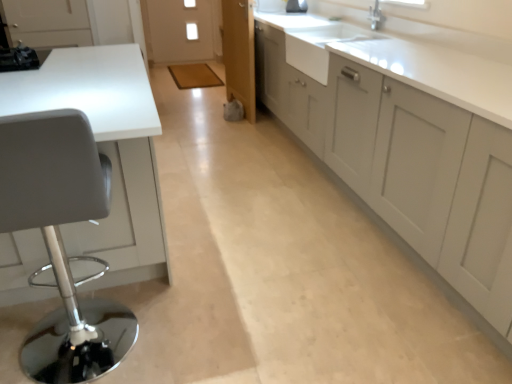
What is the approximate height of white glossy countertop at left?

The height of white glossy countertop at left is 35.45 inches.

The image size is (512, 384). Find the location of `white glossy countertop at left`. white glossy countertop at left is located at coordinates (106, 151).

At what (x,y) coordinates should I click in order to perform the action: click on white ceramic sink at upper right. Please return your answer as a coordinate pair (x, y). The height and width of the screenshot is (384, 512). Looking at the image, I should click on (320, 46).

What's the angular difference between white ceramic sink at upper right and white glossy countertop at left's facing directions?

89.1 degrees.

Where is `countertop below the white ceramic sink at upper right (from a real-world perspective)`? countertop below the white ceramic sink at upper right (from a real-world perspective) is located at coordinates (106, 151).

Choose the correct answer: Is white ceramic sink at upper right inside white glossy countertop at left or outside it?

white ceramic sink at upper right is not inside white glossy countertop at left, it's outside.

From a real-world perspective, which is physically below, white ceramic sink at upper right or white glossy countertop at left?

white glossy countertop at left is physically lower.

What's the angular difference between matte gray cabinets at right and white glossy countertop at left's facing directions?

90.4 degrees.

Does matte gray cabinets at right contain white glossy countertop at left?

No, white glossy countertop at left is not inside matte gray cabinets at right.

Is matte gray cabinets at right bigger than white glossy countertop at left?

Yes, matte gray cabinets at right is bigger than white glossy countertop at left.

Does matte gray cabinets at right have a greater width compared to white glossy countertop at left?

No.

Considering the sizes of white glossy countertop at left and matte gray cabinets at right in the image, is white glossy countertop at left taller or shorter than matte gray cabinets at right?

white glossy countertop at left is shorter than matte gray cabinets at right.

Is white glossy countertop at left facing away from matte gray cabinets at right?

No, white glossy countertop at left is not facing away from matte gray cabinets at right.

From the image's perspective, which one is positioned lower, white glossy countertop at left or matte gray cabinets at right?

white glossy countertop at left is shown below in the image.

From a real-world perspective, who is located lower, white glossy countertop at left or matte gray cabinets at right?

white glossy countertop at left, from a real-world perspective.

Which of these two, white glossy countertop at left or white ceramic sink at upper right, is thinner?

With smaller width is white ceramic sink at upper right.

Considering the sizes of objects white glossy countertop at left and white ceramic sink at upper right in the image provided, who is shorter, white glossy countertop at left or white ceramic sink at upper right?

With less height is white ceramic sink at upper right.

Can you confirm if white glossy countertop at left is smaller than white ceramic sink at upper right?

No, white glossy countertop at left is not smaller than white ceramic sink at upper right.

Is white glossy countertop at left not near white ceramic sink at upper right?

Yes.

Find the location of a particular element. cabinetry that appears on the right of white ceramic sink at upper right is located at coordinates (404, 159).

Considering the relative sizes of matte gray cabinets at right and white ceramic sink at upper right in the image provided, is matte gray cabinets at right wider than white ceramic sink at upper right?

Indeed, matte gray cabinets at right has a greater width compared to white ceramic sink at upper right.

Is matte gray cabinets at right not within white ceramic sink at upper right?

Yes, matte gray cabinets at right is located beyond the bounds of white ceramic sink at upper right.

Does white ceramic sink at upper right have a lesser height compared to matte gray cabinets at right?

Yes.

From the image's perspective, would you say white ceramic sink at upper right is positioned over matte gray cabinets at right?

Yes, from the image's perspective, white ceramic sink at upper right is over matte gray cabinets at right.

From a real-world perspective, is white ceramic sink at upper right above or below matte gray cabinets at right?

In terms of real-world spatial position, white ceramic sink at upper right is above matte gray cabinets at right.

Is white ceramic sink at upper right closer to the viewer compared to matte gray cabinets at right?

→ No.

This screenshot has height=384, width=512. Find the location of `countertop below the white ceramic sink at upper right (from a real-world perspective)`. countertop below the white ceramic sink at upper right (from a real-world perspective) is located at coordinates (106, 151).

What are the coordinates of `cabinetry in front of the white glossy countertop at left` in the screenshot? It's located at (404, 159).

Which object lies further to the anchor point white glossy countertop at left, white ceramic sink at upper right or matte gray cabinets at right?

Among the two, white ceramic sink at upper right is located further to white glossy countertop at left.

Considering their positions, is white glossy countertop at left positioned closer to matte gray cabinets at right than white ceramic sink at upper right?

white ceramic sink at upper right lies closer to matte gray cabinets at right than the other object.

When comparing their distances from matte gray cabinets at right, does white ceramic sink at upper right or white glossy countertop at left seem further?

The object further to matte gray cabinets at right is white glossy countertop at left.

Which object lies further to the anchor point white ceramic sink at upper right, matte gray cabinets at right or white glossy countertop at left?

white glossy countertop at left is further to white ceramic sink at upper right.

Looking at the image, which one is located further to white glossy countertop at left, matte gray cabinets at right or white ceramic sink at upper right?

white ceramic sink at upper right is further to white glossy countertop at left.

Which object lies further to the anchor point white ceramic sink at upper right, white glossy countertop at left or matte gray cabinets at right?

The object further to white ceramic sink at upper right is white glossy countertop at left.

Where is `sink between white glossy countertop at left and matte gray cabinets at right`? The height and width of the screenshot is (384, 512). sink between white glossy countertop at left and matte gray cabinets at right is located at coordinates (320, 46).